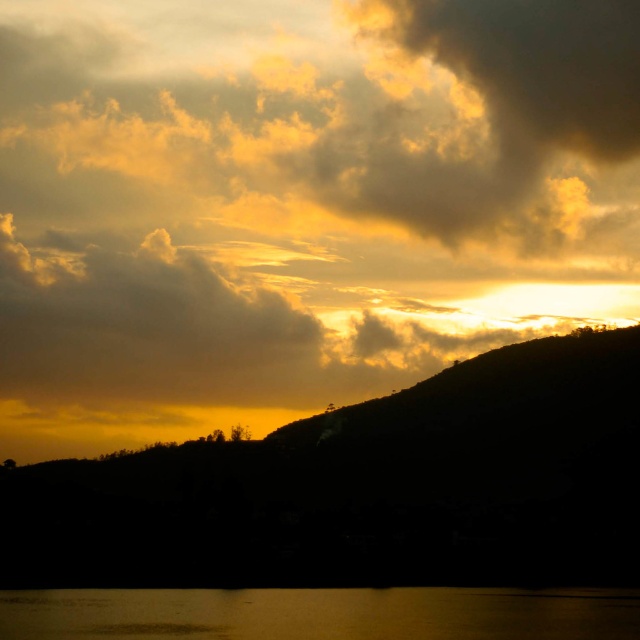
You are an observer standing at the lakeside. You see the golden matte cloud at upper center and the silvery reflective water at lower center. Which object is closer to you?

The golden matte cloud at upper center is closer to you because the silvery reflective water at lower center is behind it.

You are standing on the shore of the lake and see the silhouette mountain at center and the silvery reflective water at lower center. Which object is positioned to the right side of the other?

The silhouette mountain at center is positioned to the right of the silvery reflective water at lower center.

Based on the photo, you are standing on the shore of the lake and want to take a photo of the sunset. You notice the silhouette mountain at center and the silvery reflective water at lower center. Which object is closer to you, the photographer?

The silhouette mountain at center is closer to you than the silvery reflective water at lower center because the water is positioned behind the mountain.